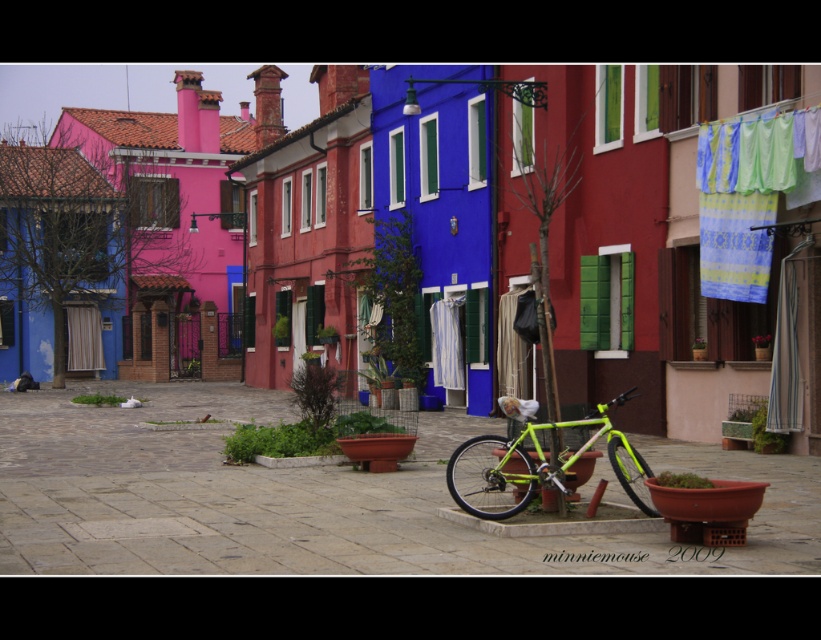
Question: Among these points, which one is farthest from the camera?

Choices:
 (A) (601, 417)
 (B) (735, 566)
 (C) (753, 184)

Answer: (C)

Question: Is neon green bicycle at center thinner than neon green frame at center?

Choices:
 (A) no
 (B) yes

Answer: (A)

Question: Which of these objects is positioned closest to the neon green frame at center?

Choices:
 (A) neon green bicycle at center
 (B) blue striped fabric at upper right

Answer: (B)

Question: Which is nearer to the neon green bicycle at center?

Choices:
 (A) blue striped fabric at upper right
 (B) neon green frame at center

Answer: (A)

Question: From the image, what is the correct spatial relationship of neon green bicycle at center in relation to blue striped fabric at upper right?

Choices:
 (A) right
 (B) left

Answer: (B)

Question: Is the position of neon green bicycle at center more distant than that of blue striped fabric at upper right?

Choices:
 (A) no
 (B) yes

Answer: (A)